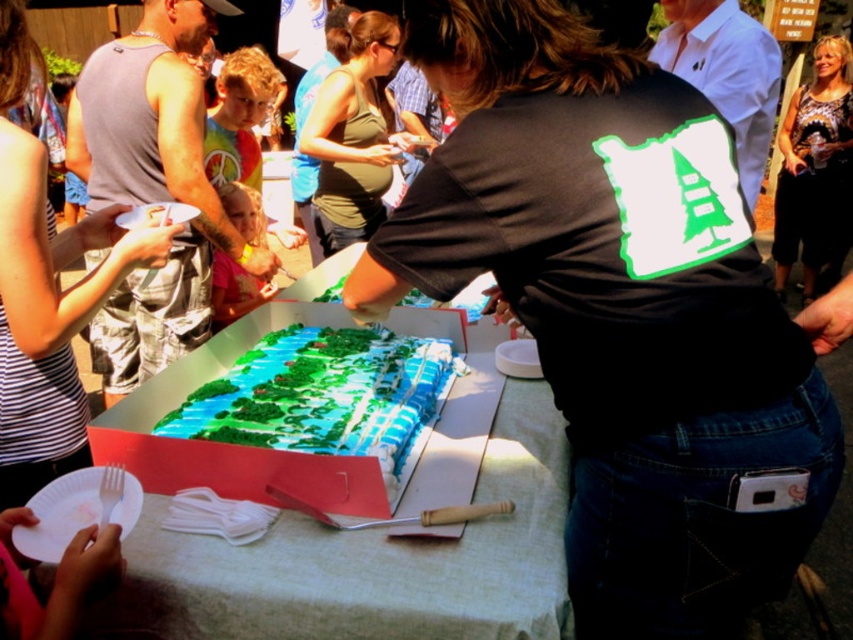
Question: From the image, what is the correct spatial relationship of printed fabric blouse at center in relation to white paper plate at upper left?

Choices:
 (A) above
 (B) below

Answer: (A)

Question: Which of these objects is positioned farthest from the striped fabric tank top at left?

Choices:
 (A) green fondant cake at center
 (B) white paper plate at upper left
 (C) printed fabric blouse at center

Answer: (C)

Question: Which point is farther to the camera?

Choices:
 (A) (0, 330)
 (B) (36, 499)

Answer: (A)

Question: Can you confirm if striped fabric tank top at left is positioned to the right of green fondant cake at center?

Choices:
 (A) no
 (B) yes

Answer: (A)

Question: Among these points, which one is nearest to the camera?

Choices:
 (A) (126, 216)
 (B) (808, 113)
 (C) (241, 406)
 (D) (117, 262)

Answer: (D)

Question: Can you confirm if white paper plate at center is smaller than green matte tank top at center?

Choices:
 (A) yes
 (B) no

Answer: (B)